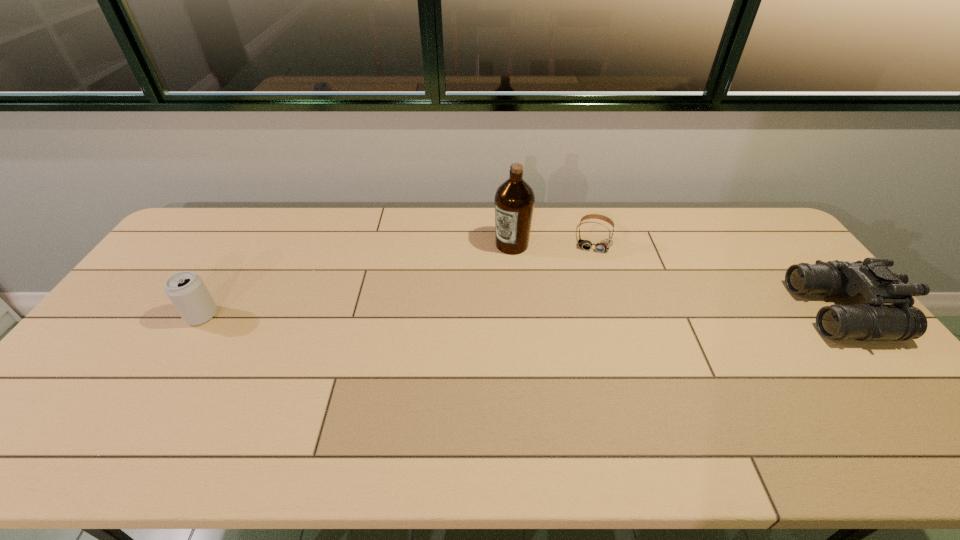
Locate an element on the screen. This screenshot has width=960, height=540. can is located at coordinates (186, 290).

This screenshot has height=540, width=960. I want to click on the rightmost object, so click(x=889, y=315).

Where is `the second object from left to right`? the second object from left to right is located at coordinates (514, 200).

At what (x,y) coordinates should I click in order to perform the action: click on olive oil. Please return your answer as a coordinate pair (x, y). The width and height of the screenshot is (960, 540). Looking at the image, I should click on (514, 200).

Locate an element on the screen. goggles is located at coordinates (604, 245).

Identify the location of the shortest object. The height and width of the screenshot is (540, 960). (604, 245).

This screenshot has height=540, width=960. I want to click on vacant space located on the back of the leftmost object, so click(x=252, y=236).

Where is `free space located 0.350m on the label of the tallest object`? This screenshot has width=960, height=540. free space located 0.350m on the label of the tallest object is located at coordinates (434, 319).

At what (x,y) coordinates should I click in order to perform the action: click on vacant space located 0.130m on the label of the tallest object. Please return your answer as a coordinate pair (x, y). The width and height of the screenshot is (960, 540). Looking at the image, I should click on (479, 276).

Where is `vacant area situated 0.390m on the label of the tallest object`? This screenshot has width=960, height=540. vacant area situated 0.390m on the label of the tallest object is located at coordinates (424, 327).